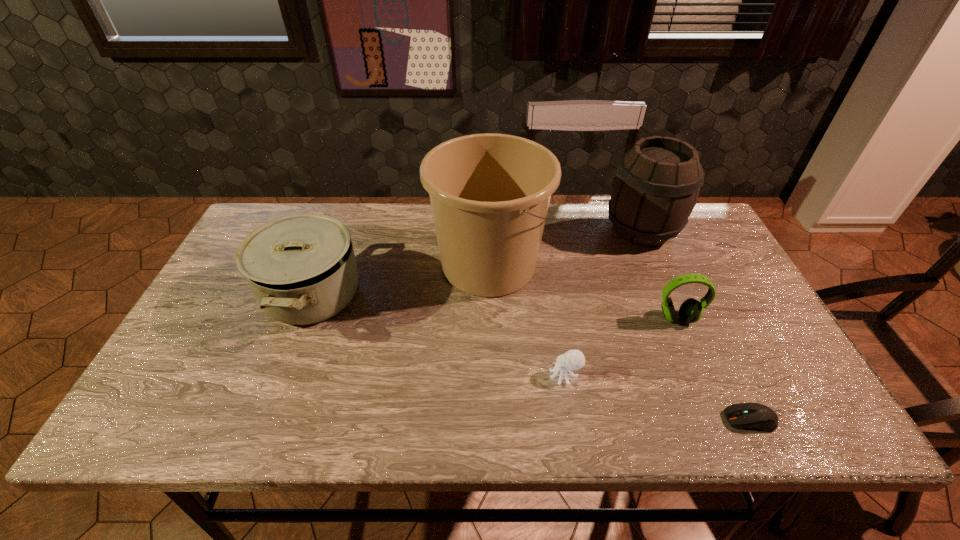
You are a GUI agent. You are given a task and a screenshot of the screen. Output one action in this format:
    pyautogui.click(x=<x>, y=<y>)
    Task: Click on the vacant space situated 0.390m on the left of the fifth shortest object
    This screenshot has width=960, height=540.
    Given the screenshot: What is the action you would take?
    480,230

The image size is (960, 540). I want to click on vacant space situated on the right of the saucepan, so click(x=392, y=294).

At what (x,y) coordinates should I click in order to perform the action: click on vacant point located on the front of the fourth tallest object. Please return your answer as a coordinate pair (x, y). The height and width of the screenshot is (540, 960). Looking at the image, I should click on (688, 345).

Where is `vacant area situated on the front-facing side of the second shortest object`? Image resolution: width=960 pixels, height=540 pixels. vacant area situated on the front-facing side of the second shortest object is located at coordinates (488, 375).

The image size is (960, 540). Find the location of `vacant space situated 0.250m on the front-facing side of the second shortest object`. vacant space situated 0.250m on the front-facing side of the second shortest object is located at coordinates (440, 375).

Find the location of a particular element. This screenshot has height=540, width=960. vacant space located 0.160m on the front-facing side of the second shortest object is located at coordinates (479, 375).

Where is `blank space located 0.120m on the button of the shortest object`? The width and height of the screenshot is (960, 540). blank space located 0.120m on the button of the shortest object is located at coordinates (668, 420).

The image size is (960, 540). I want to click on free space located on the button of the shortest object, so click(540, 420).

Locate an element on the screen. The height and width of the screenshot is (540, 960). free space located on the button of the shortest object is located at coordinates (635, 420).

The height and width of the screenshot is (540, 960). In order to click on bucket located in the far edge section of the desktop in this screenshot , I will do `click(489, 193)`.